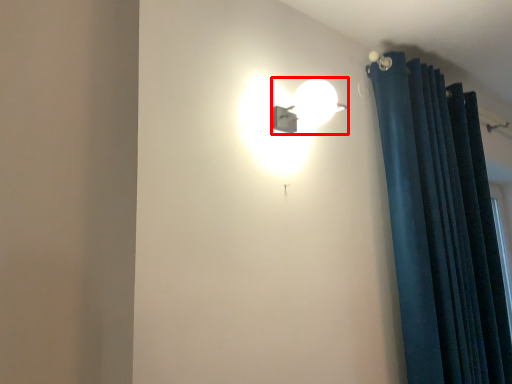
Question: From the image, what is the correct spatial relationship of lamp (annotated by the red box) in relation to curtain?

Choices:
 (A) right
 (B) left

Answer: (B)